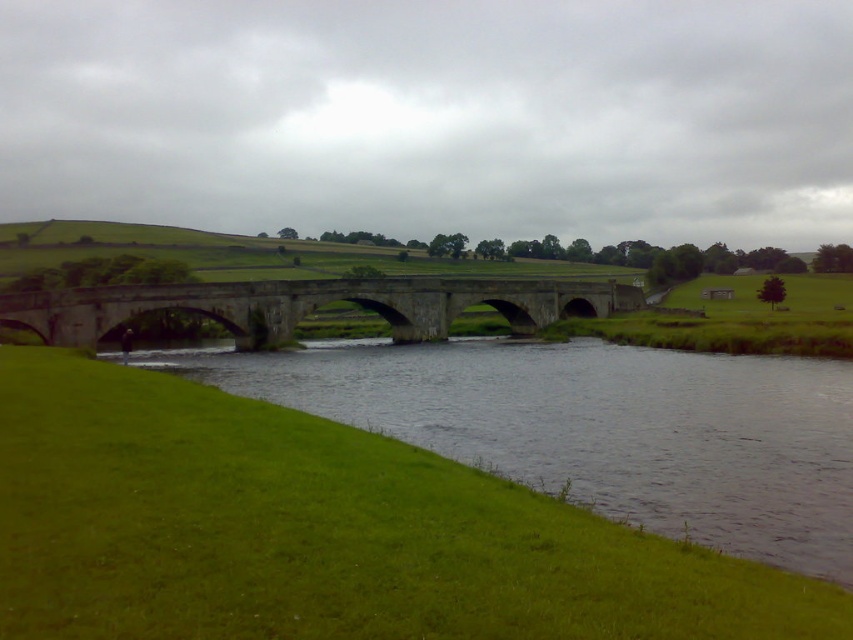
Between green grassy river at lower left and stone bridge at center, which one appears on the left side from the viewer's perspective?

Positioned to the left is stone bridge at center.

Is point (784, 440) positioned after point (57, 333)?

No, (784, 440) is closer to viewer.

You are a GUI agent. You are given a task and a screenshot of the screen. Output one action in this format:
    pyautogui.click(x=<x>, y=<y>)
    Task: Click on the green grassy river at lower left
    The height and width of the screenshot is (640, 853).
    Given the screenshot: What is the action you would take?
    pyautogui.click(x=596, y=428)